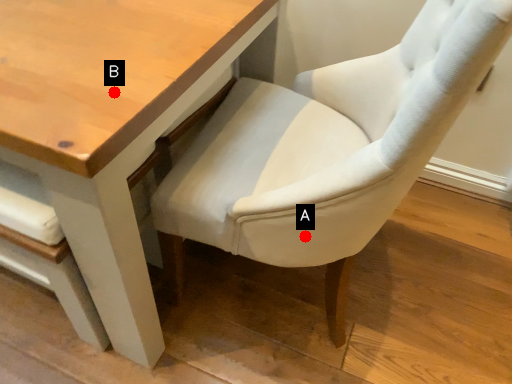
Question: Two points are circled on the image, labeled by A and B beside each circle. Which of the following is the closest to the observer?

Choices:
 (A) A is closer
 (B) B is closer

Answer: (B)